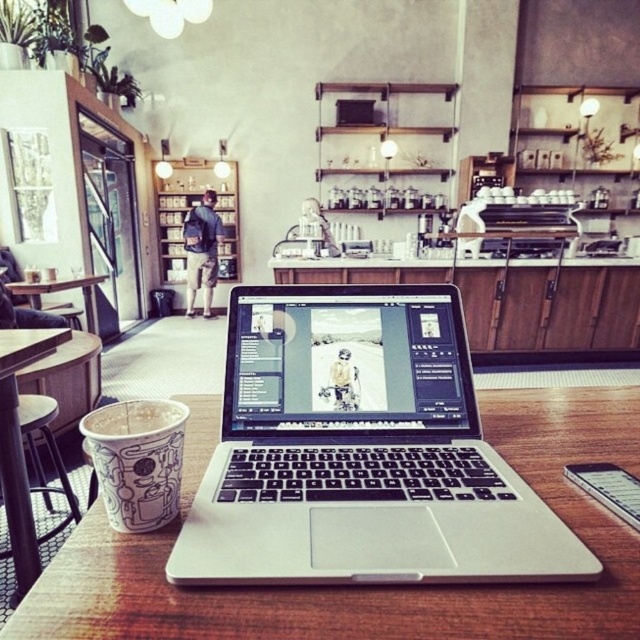
Is wooden table at center thinner than white matte cup at lower left?

No, wooden table at center is not thinner than white matte cup at lower left.

Between point (419, 634) and point (122, 416), which one is positioned in front?

Positioned in front is point (419, 634).

Which is behind, point (64, 570) or point (150, 428)?

Positioned behind is point (150, 428).

Locate an element on the screen. This screenshot has height=640, width=640. wooden table at center is located at coordinates (376, 586).

Is wooden table at center below white paper cup at center?

Yes, wooden table at center is below white paper cup at center.

This screenshot has height=640, width=640. What do you see at coordinates (376, 586) in the screenshot?
I see `wooden table at center` at bounding box center [376, 586].

Does point (102, 554) come farther from viewer compared to point (108, 497)?

No, it is not.

Find the location of `wooden table at center`. wooden table at center is located at coordinates (376, 586).

Is white paper cup at center above white matte cup at lower left?

Actually, white paper cup at center is below white matte cup at lower left.

Is white paper cup at center thinner than white matte cup at lower left?

Yes, white paper cup at center is thinner than white matte cup at lower left.

This screenshot has width=640, height=640. In order to click on white paper cup at center in this screenshot , I will do `click(138, 460)`.